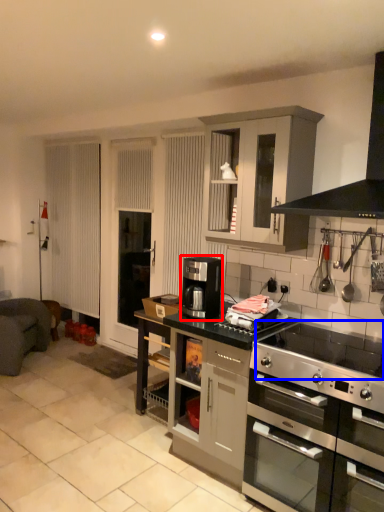
Question: Which object appears closest to the camera in this image, coffee machine (highlighted by a red box) or gas stove (highlighted by a blue box)?

Choices:
 (A) coffee machine
 (B) gas stove

Answer: (B)